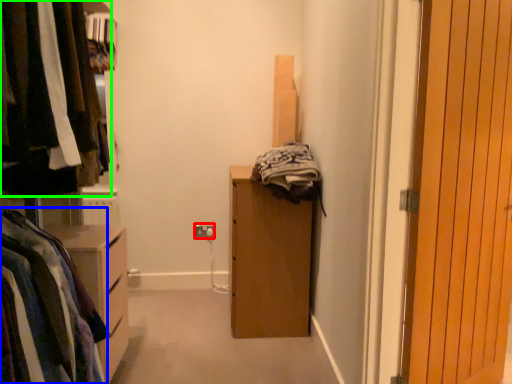
Question: Based on their relative distances, which object is farther from electric outlet (highlighted by a red box)? Choose from clothing (highlighted by a blue box) and closet (highlighted by a green box).

Choices:
 (A) clothing
 (B) closet

Answer: (A)